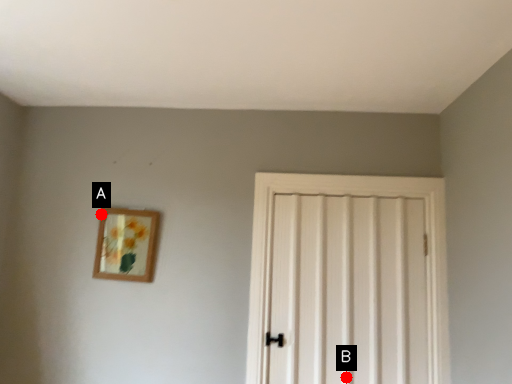
Question: Two points are circled on the image, labeled by A and B beside each circle. Which point is closer to the camera taking this photo?

Choices:
 (A) A is closer
 (B) B is closer

Answer: (B)